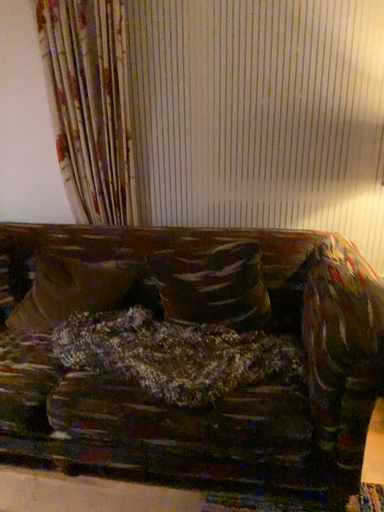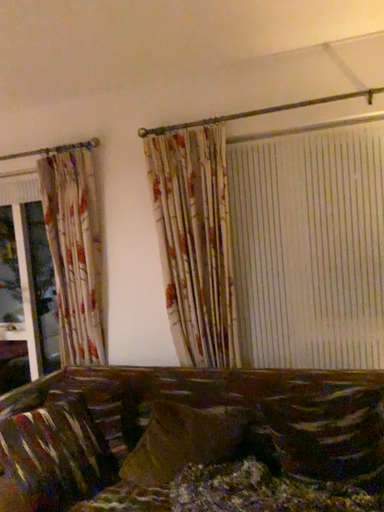
Question: Which way did the camera rotate in the video?

Choices:
 (A) rotated downward
 (B) rotated upward

Answer: (B)